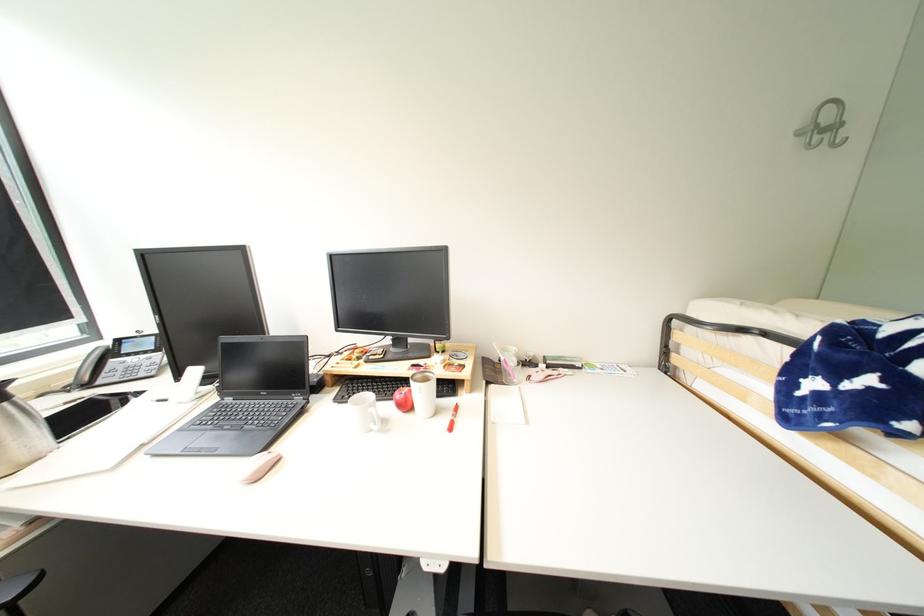
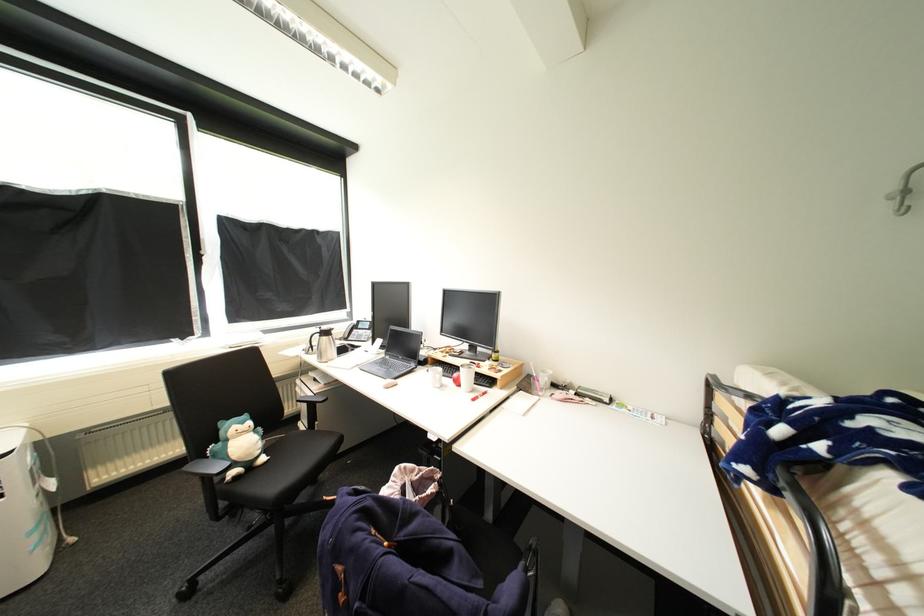
Locate, in the second image, the point that corresponds to [333,390] in the first image.

(434, 366)